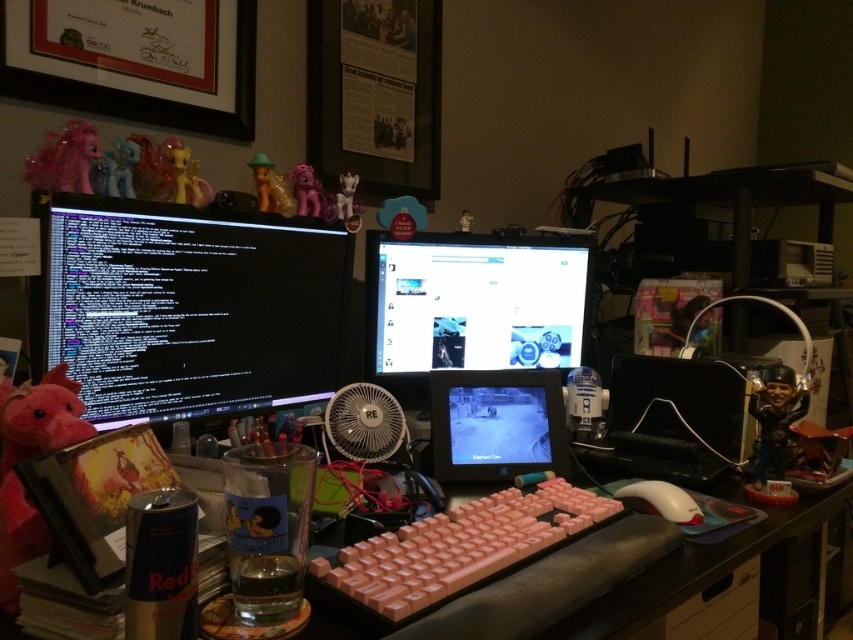
Can you confirm if peach matte keyboard at center is wider than pink plastic toy at upper center?

Correct, the width of peach matte keyboard at center exceeds that of pink plastic toy at upper center.

Between point (390, 579) and point (305, 179), which one is positioned in front?

Point (390, 579)

Which is in front, point (505, 490) or point (292, 184)?

Point (505, 490)

The image size is (853, 640). Find the location of `peach matte keyboard at center`. peach matte keyboard at center is located at coordinates (459, 547).

Locate an element on the screen. Image resolution: width=853 pixels, height=640 pixels. pink plastic keyboard at center is located at coordinates (695, 568).

Does pink plastic keyboard at center have a lesser width compared to matte pink pony at upper left?

Incorrect, pink plastic keyboard at center's width is not less than matte pink pony at upper left's.

Who is more distant from viewer, [787,512] or [126,147]?

The point [787,512] is more distant.

The width and height of the screenshot is (853, 640). Find the location of `pink plastic keyboard at center`. pink plastic keyboard at center is located at coordinates (695, 568).

Does pink plush toy at upper left have a greater height compared to shiny gold figurine at upper center?

No.

Can you confirm if pink plush toy at upper left is thinner than shiny gold figurine at upper center?

In fact, pink plush toy at upper left might be wider than shiny gold figurine at upper center.

Does point (74, 138) lie behind point (257, 202)?

No, (74, 138) is closer to viewer.

This screenshot has height=640, width=853. Identify the location of pink plush toy at upper left. [x=64, y=160].